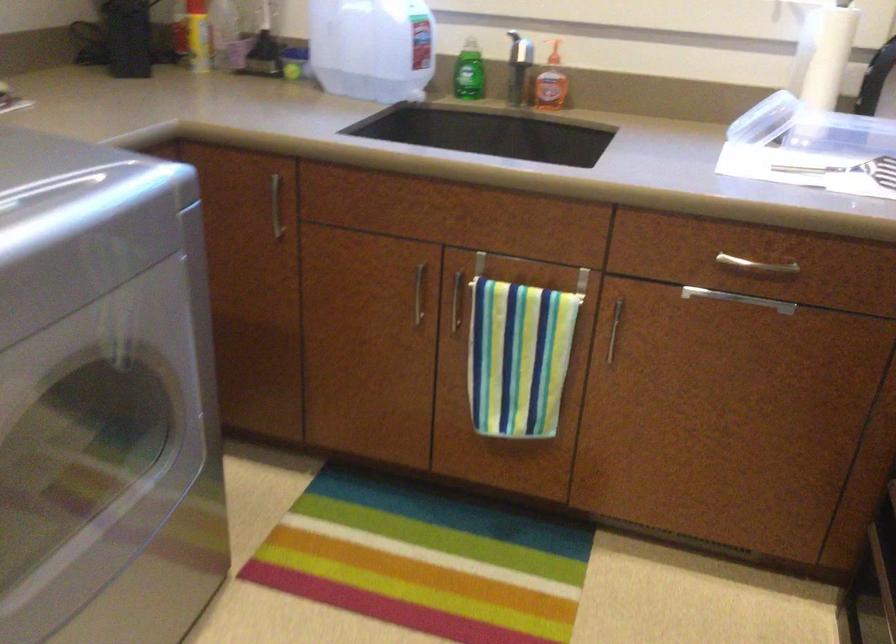
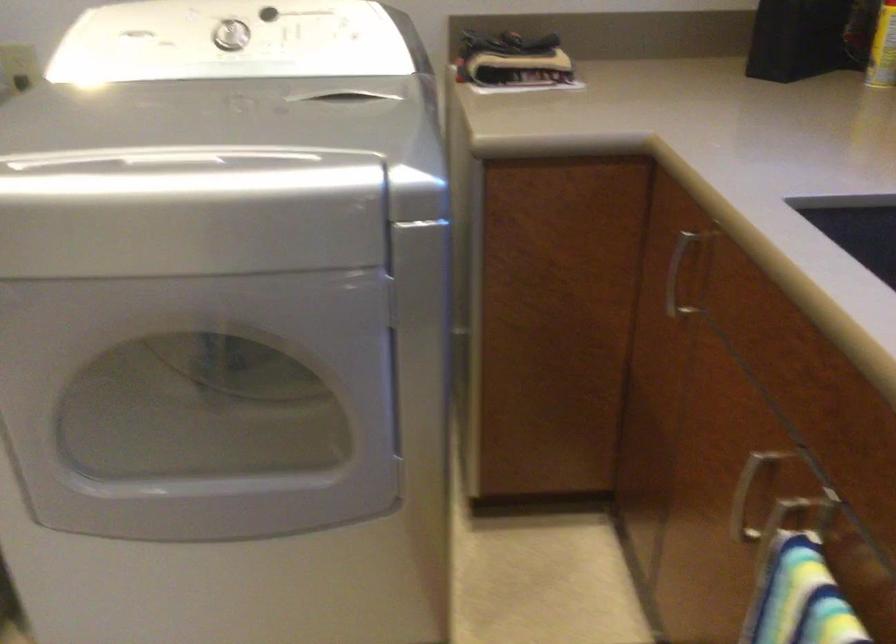
In the second image, find the point that corresponds to point (254, 213) in the first image.

(677, 275)